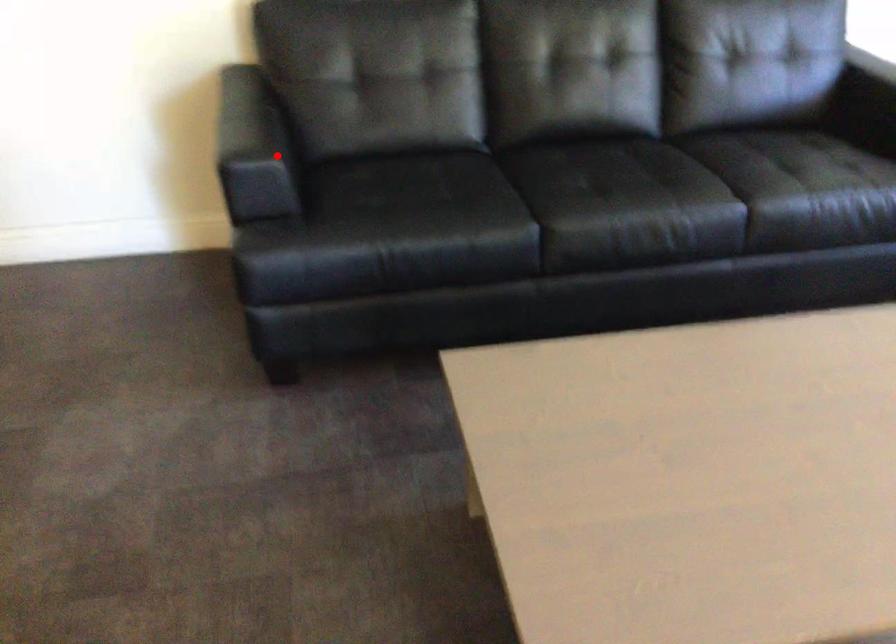
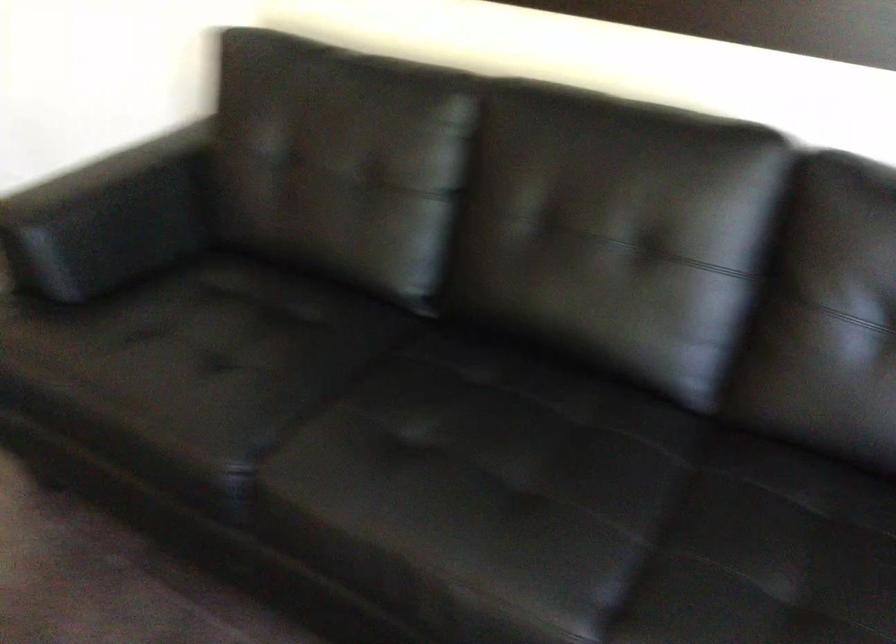
Question: I am providing you with two images of the same scene from different viewpoints. Given a red point in image1, look at the same physical point in image2. Is it:

Choices:
 (A) Closer to the viewpoint
 (B) Farther from the viewpoint

Answer: (A)